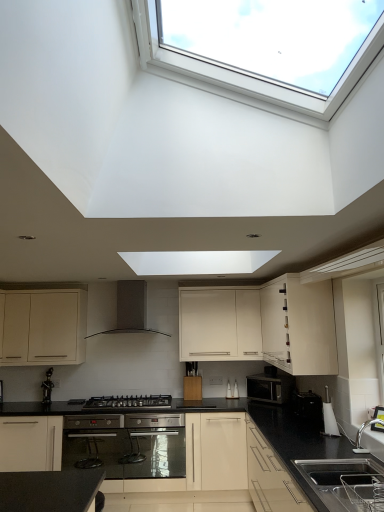
Question: From a real-world perspective, is white glossy cabinet at upper right, acting as the third cabinetry starting from the left, positioned under white plastic kettle at lower right, the third appliance viewed from the back, based on gravity?

Choices:
 (A) no
 (B) yes

Answer: (A)

Question: Is white glossy cabinet at upper right, acting as the third cabinetry starting from the left, outside white plastic kettle at lower right, the third appliance viewed from the back?

Choices:
 (A) yes
 (B) no

Answer: (A)

Question: Is white glossy cabinet at upper right, positioned as the first cabinetry in right-to-left order, oriented towards white plastic kettle at lower right, the third appliance viewed from the back?

Choices:
 (A) yes
 (B) no

Answer: (B)

Question: Can you confirm if white glossy cabinet at upper right, acting as the third cabinetry starting from the left, is positioned to the left of white plastic kettle at lower right, the third appliance viewed from the back?

Choices:
 (A) no
 (B) yes

Answer: (B)

Question: From a real-world perspective, is white glossy cabinet at upper right, positioned as the first cabinetry in right-to-left order, on white plastic kettle at lower right, the third appliance viewed from the back?

Choices:
 (A) yes
 (B) no

Answer: (A)

Question: Is white glossy cabinet at upper right, positioned as the first cabinetry in right-to-left order, oriented away from white plastic kettle at lower right, acting as the first appliance starting from the front?

Choices:
 (A) no
 (B) yes

Answer: (A)

Question: From a real-world perspective, does matte white cabinet at lower left, which is the third cabinetry from right to left, sit lower than black plastic toaster at lower right, the second appliance when ordered from front to back?

Choices:
 (A) yes
 (B) no

Answer: (B)

Question: Is matte white cabinet at lower left, which is the third cabinetry from right to left, bigger than black plastic toaster at lower right, the second appliance when ordered from front to back?

Choices:
 (A) yes
 (B) no

Answer: (A)

Question: Is matte white cabinet at lower left, which is the third cabinetry from right to left, behind black plastic toaster at lower right, the second appliance when ordered from front to back?

Choices:
 (A) no
 (B) yes

Answer: (B)

Question: From the image's perspective, is matte white cabinet at lower left, positioned as the first cabinetry in left-to-right order, beneath black plastic toaster at lower right, which is counted as the second appliance, starting from the back?

Choices:
 (A) yes
 (B) no

Answer: (B)

Question: Considering the relative sizes of matte white cabinet at lower left, which is the third cabinetry from right to left, and black plastic toaster at lower right, the second appliance when ordered from front to back, in the image provided, is matte white cabinet at lower left, which is the third cabinetry from right to left, taller than black plastic toaster at lower right, the second appliance when ordered from front to back,?

Choices:
 (A) no
 (B) yes

Answer: (B)

Question: Can you confirm if matte white cabinet at lower left, which is the third cabinetry from right to left, is thinner than black plastic toaster at lower right, which is counted as the second appliance, starting from the back?

Choices:
 (A) no
 (B) yes

Answer: (A)

Question: Is white plastic kettle at lower right, the third appliance viewed from the back, positioned with its back to black matte gas stove at center?

Choices:
 (A) yes
 (B) no

Answer: (B)